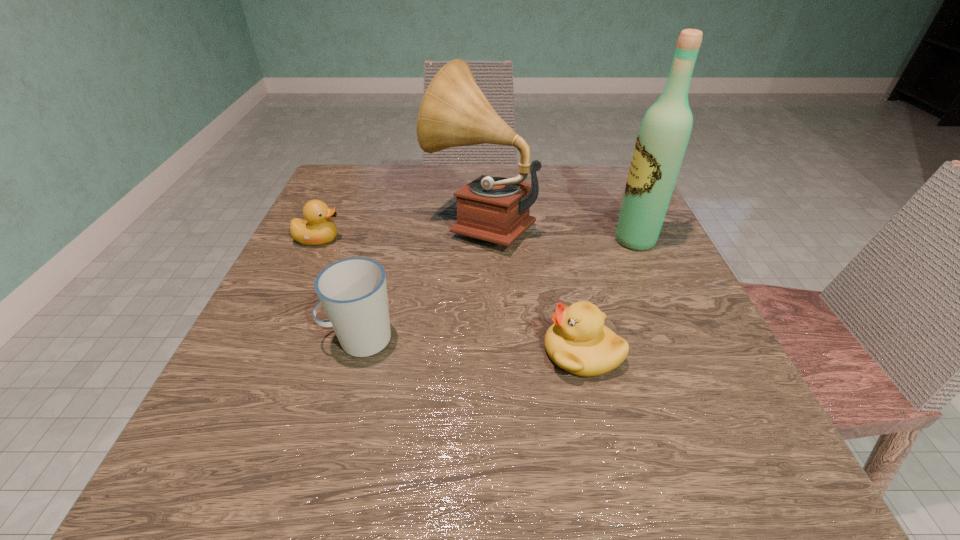
This screenshot has width=960, height=540. In order to click on the tallest object in this screenshot , I will do `click(665, 130)`.

At what (x,y) coordinates should I click in order to perform the action: click on wine bottle. Please return your answer as a coordinate pair (x, y). Looking at the image, I should click on (665, 130).

You are a GUI agent. You are given a task and a screenshot of the screen. Output one action in this format:
    pyautogui.click(x=<x>, y=<y>)
    Task: Click on the phonograph record
    
    Given the screenshot: What is the action you would take?
    pyautogui.click(x=454, y=112)

Where is `the fourth object from right to left`? This screenshot has width=960, height=540. the fourth object from right to left is located at coordinates (353, 292).

At what (x,y) coordinates should I click in order to perform the action: click on the third shortest object. Please return your answer as a coordinate pair (x, y). Looking at the image, I should click on (353, 292).

At what (x,y) coordinates should I click in order to perform the action: click on the nearer duckling. Please return your answer as a coordinate pair (x, y). This screenshot has width=960, height=540. Looking at the image, I should click on (578, 342).

Locate an element on the screen. The image size is (960, 540). the farther duckling is located at coordinates (317, 229).

Where is `the left duckling`? This screenshot has width=960, height=540. the left duckling is located at coordinates 317,229.

Find the location of a particular element. free region located on the front-facing side of the wine bottle is located at coordinates (589, 240).

Identify the location of free region located on the front-facing side of the wine bottle. (425, 240).